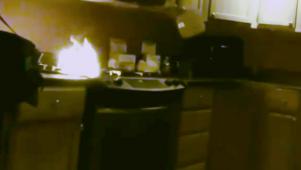
You are a GUI agent. You are given a task and a screenshot of the screen. Output one action in this format:
    pyautogui.click(x=<x>, y=<y>)
    Task: Click on the knobs
    This screenshot has width=301, height=170.
    Given the screenshot: What is the action you would take?
    pyautogui.click(x=175, y=83), pyautogui.click(x=167, y=83), pyautogui.click(x=121, y=83)